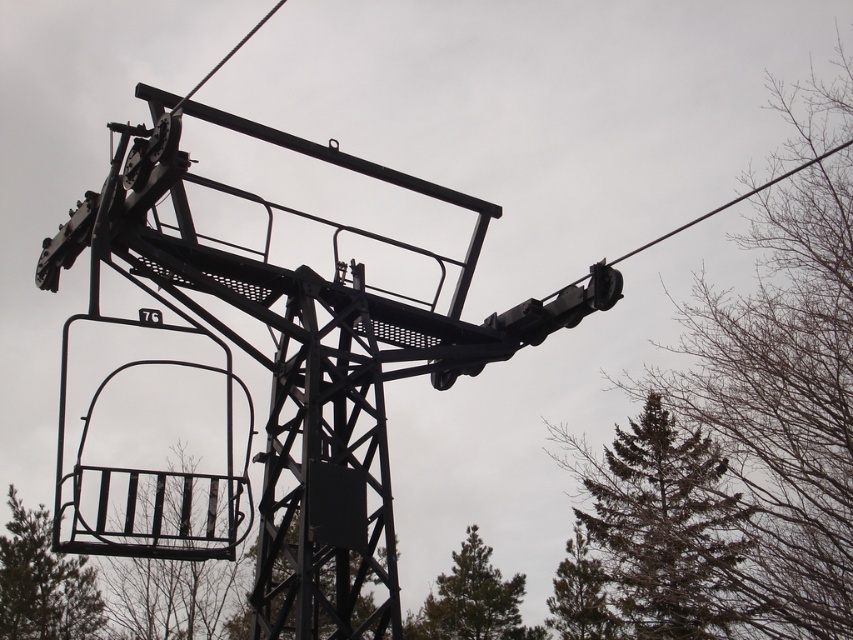
You are planning to hang a small birdhouse on the ski lift structure. The birdhouse is the size of the green textured pine tree at upper right. Will it fit in the metallic wire basket at lower left?

The green textured pine tree at upper right is smaller than the metallic wire basket at lower left, so the birdhouse will fit in the metallic wire basket at lower left.